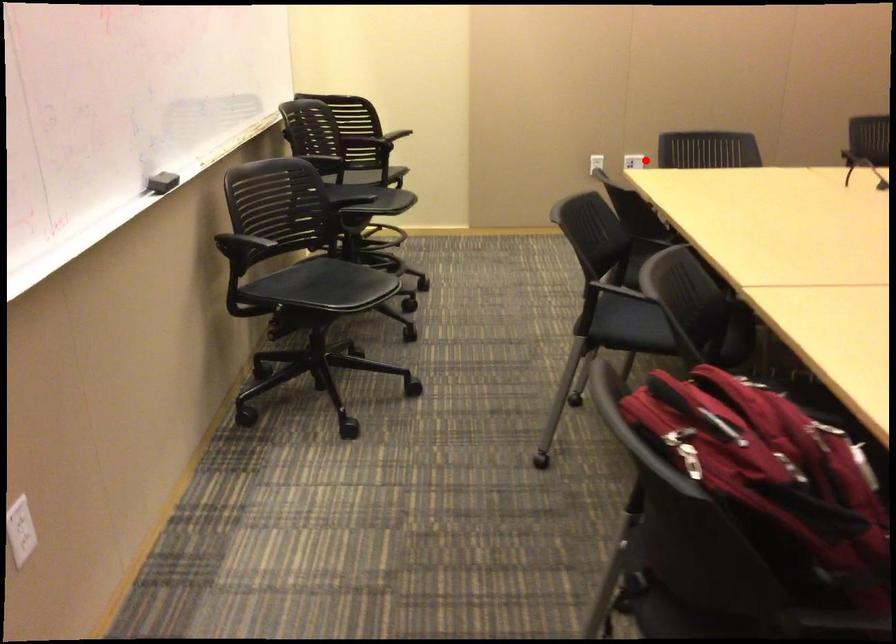
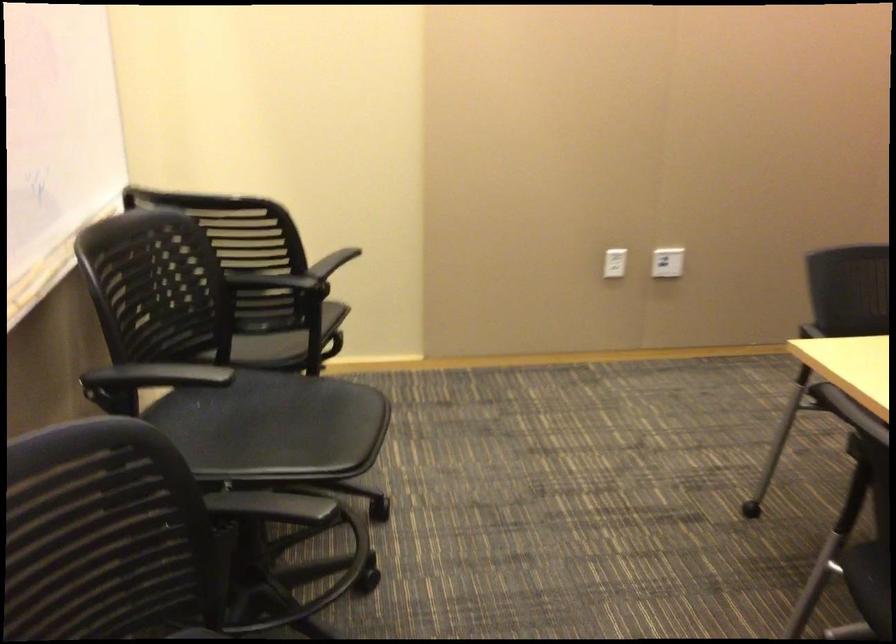
Question: A red point is marked in image1. In image2, is the corresponding 3D point closer to the camera or farther? Reply with the corresponding letter.

Choices:
 (A) The corresponding 3D point is closer.
 (B) The corresponding 3D point is farther.

Answer: (A)